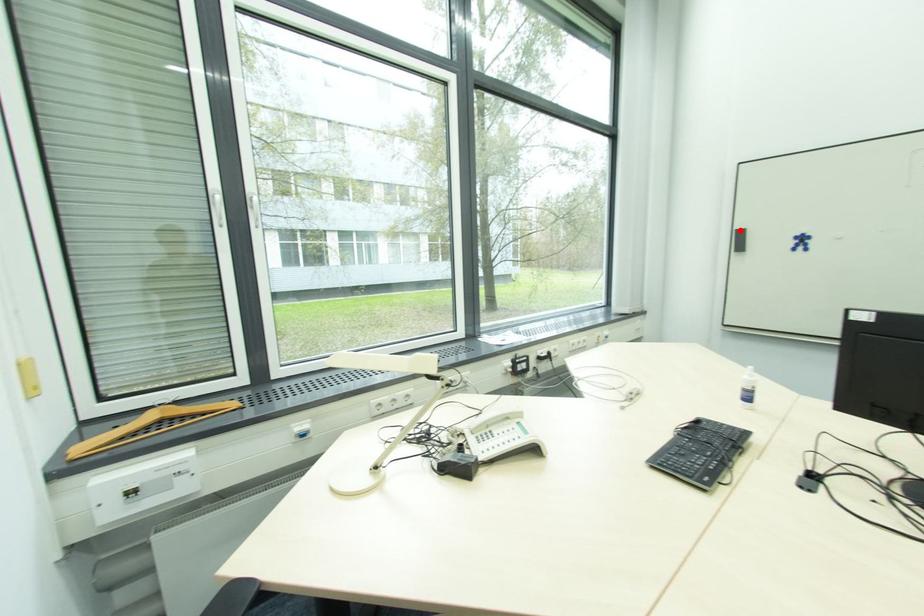
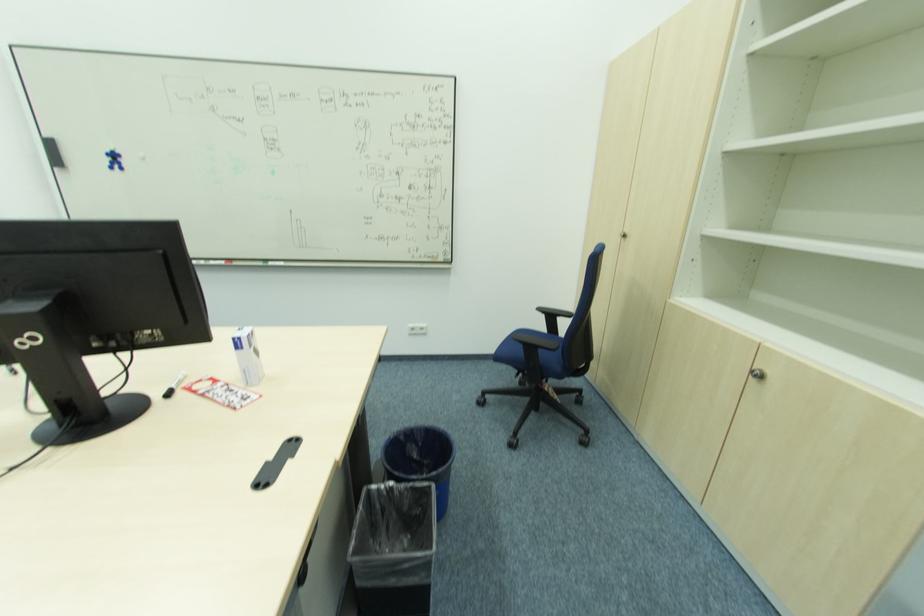
Question: I am providing you with two images of the same scene from different viewpoints. Image1 has a red point marked. In image2, the corresponding 3D location appears at what relative position? Reply with the corresponding letter.

Choices:
 (A) Closer
 (B) Farther

Answer: (B)